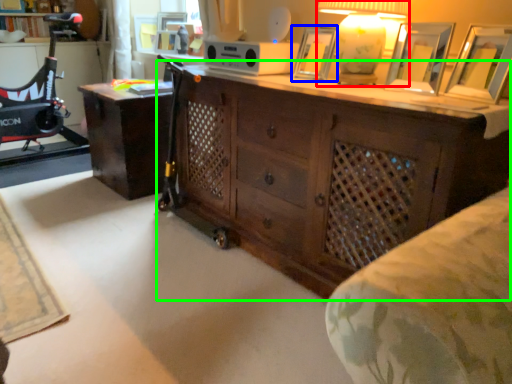
Question: Based on their relative distances, which object is farther from table lamp (highlighted by a red box)? Choose from picture frame (highlighted by a blue box) and chest of drawers (highlighted by a green box).

Choices:
 (A) picture frame
 (B) chest of drawers

Answer: (B)